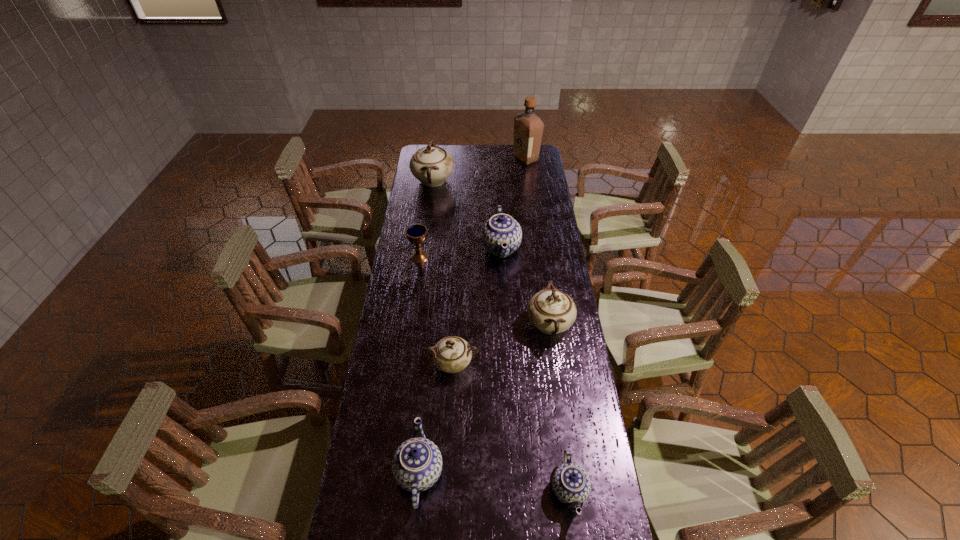
Image resolution: width=960 pixels, height=540 pixels. Find the location of `vacant area between the second farthest chinaware and the rightmost white chinaware`. vacant area between the second farthest chinaware and the rightmost white chinaware is located at coordinates (525, 286).

Where is `object that is the closest to the smallest white chinaware`? This screenshot has height=540, width=960. object that is the closest to the smallest white chinaware is located at coordinates (551, 311).

Locate which object is the seventh closest to the farthest blue chinaware. Please provide its 2D coordinates. Your answer should be formatted as a tuple, i.e. [(x, y)], where the tuple contains the x and y coordinates of a point satisfying the conditions above.

[(571, 484)]

Select which chinaware is the sixth closest to the liquor. Please provide its 2D coordinates. Your answer should be formatted as a tuple, i.e. [(x, y)], where the tuple contains the x and y coordinates of a point satisfying the conditions above.

[(571, 484)]

At what (x,y) coordinates should I click in order to perform the action: click on chinaware that stands as the fourth closest to the rightmost white chinaware. Please return your answer as a coordinate pair (x, y). Image resolution: width=960 pixels, height=540 pixels. Looking at the image, I should click on (417, 463).

Locate which white chinaware ranks in proximity to the shortest object. Please provide its 2D coordinates. Your answer should be formatted as a tuple, i.e. [(x, y)], where the tuple contains the x and y coordinates of a point satisfying the conditions above.

[(452, 354)]

I want to click on the closest white chinaware to the second tallest object, so click(x=551, y=311).

Point out which blue chinaware is positioned as the third nearest to the smallest white chinaware. Please provide its 2D coordinates. Your answer should be formatted as a tuple, i.e. [(x, y)], where the tuple contains the x and y coordinates of a point satisfying the conditions above.

[(501, 229)]

Where is `blue chinaware that is the closest to the brown liquor`? blue chinaware that is the closest to the brown liquor is located at coordinates click(501, 229).

Identify the location of free space that satisfies the following two spatial constraints: 1. on the front side of the smallest white chinaware; 2. at the spout of the second biggest blue chinaware. (447, 472).